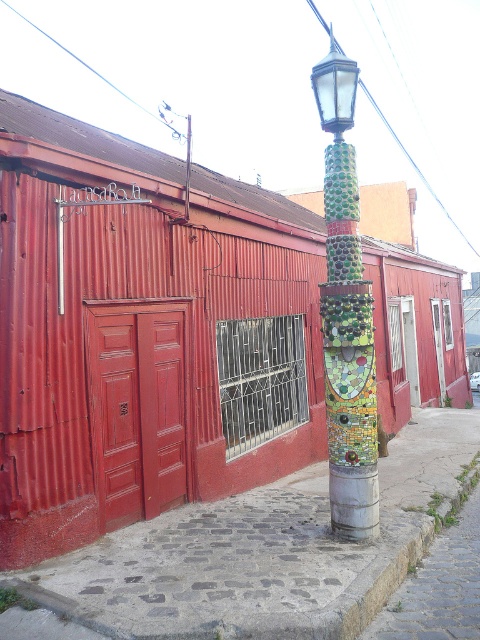
Does cobblestone pavement at center appear on the right side of green mosaic lamp post at center?

Incorrect, cobblestone pavement at center is not on the right side of green mosaic lamp post at center.

Where is `cobblestone pavement at center`? cobblestone pavement at center is located at coordinates (264, 552).

Describe the element at coordinates (264, 552) in the screenshot. I see `cobblestone pavement at center` at that location.

What are the coordinates of `cobblestone pavement at center` in the screenshot? It's located at (264, 552).